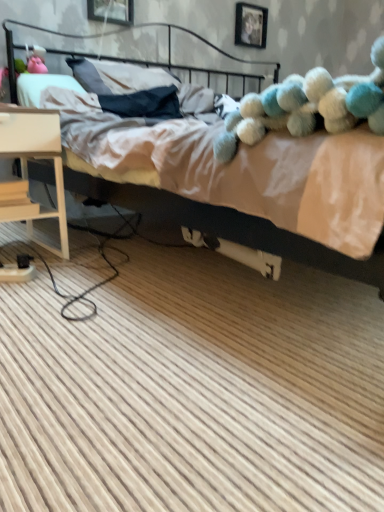
Question: Is the surface of black metal headboard at upper center in direct contact with light wood nightstand at lower left?

Choices:
 (A) no
 (B) yes

Answer: (A)

Question: Is black metal headboard at upper center wider than light wood nightstand at lower left?

Choices:
 (A) yes
 (B) no

Answer: (A)

Question: From the image's perspective, does black metal headboard at upper center appear higher than light wood nightstand at lower left?

Choices:
 (A) no
 (B) yes

Answer: (B)

Question: From the image's perspective, is black metal headboard at upper center beneath light wood nightstand at lower left?

Choices:
 (A) yes
 (B) no

Answer: (B)

Question: From a real-world perspective, is black metal headboard at upper center located higher than light wood nightstand at lower left?

Choices:
 (A) yes
 (B) no

Answer: (A)

Question: From a real-world perspective, is beige fabric bed at upper center positioned above or below light wood nightstand at lower left?

Choices:
 (A) below
 (B) above

Answer: (B)

Question: From the image's perspective, is beige fabric bed at upper center above or below light wood nightstand at lower left?

Choices:
 (A) above
 (B) below

Answer: (A)

Question: In terms of height, does beige fabric bed at upper center look taller or shorter compared to light wood nightstand at lower left?

Choices:
 (A) short
 (B) tall

Answer: (B)

Question: Would you say beige fabric bed at upper center is to the left or to the right of light wood nightstand at lower left in the picture?

Choices:
 (A) right
 (B) left

Answer: (A)

Question: Based on their positions, is black metal headboard at upper center located to the left or right of light wood nightstand at lower left?

Choices:
 (A) left
 (B) right

Answer: (B)

Question: Considering their positions, is black metal headboard at upper center located in front of or behind light wood nightstand at lower left?

Choices:
 (A) front
 (B) behind

Answer: (B)

Question: From the image's perspective, is black metal headboard at upper center above or below light wood nightstand at lower left?

Choices:
 (A) above
 (B) below

Answer: (A)

Question: Is black metal headboard at upper center wider or thinner than light wood nightstand at lower left?

Choices:
 (A) thin
 (B) wide

Answer: (B)

Question: Looking at the image, does light wood nightstand at lower left seem bigger or smaller compared to black metal headboard at upper center?

Choices:
 (A) small
 (B) big

Answer: (A)

Question: Would you say light wood nightstand at lower left is to the left or to the right of black metal headboard at upper center in the picture?

Choices:
 (A) left
 (B) right

Answer: (A)